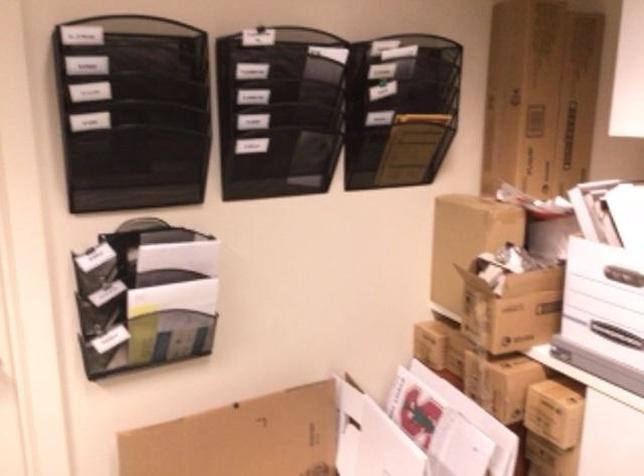
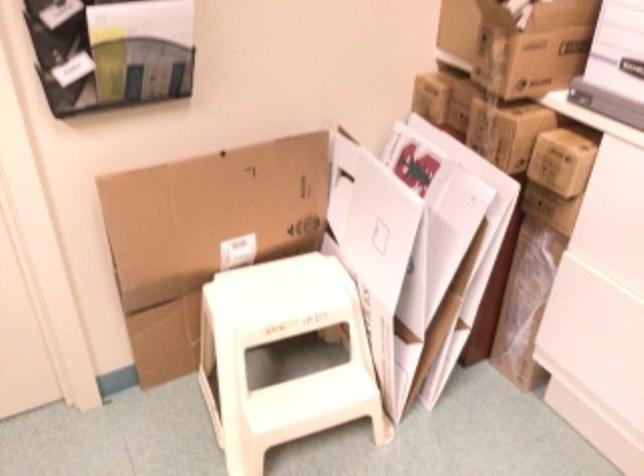
Where in the second image is the point corresponding to point 511,310 from the first image?

(532, 46)